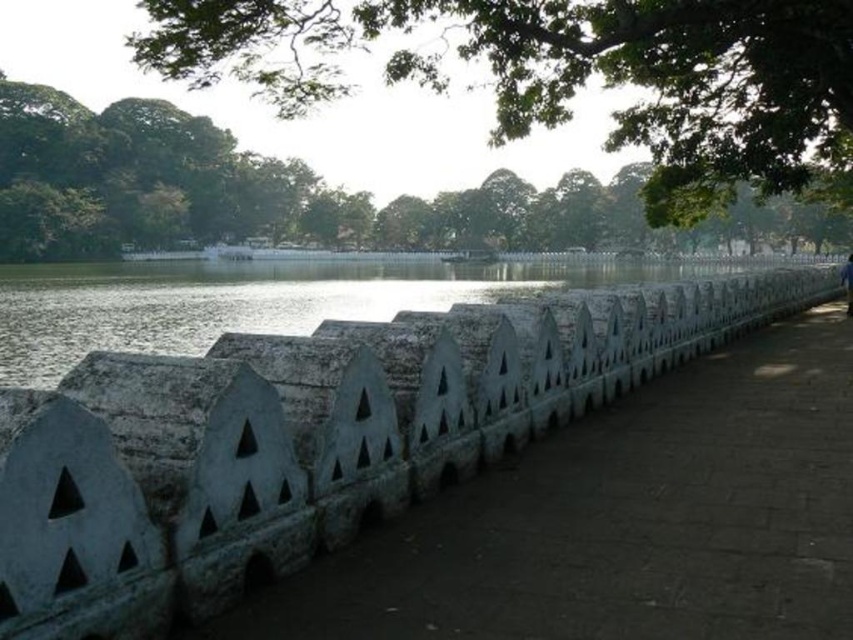
Is white stone fence at center closer to camera compared to green leafy tree at upper center?

Yes, white stone fence at center is in front of green leafy tree at upper center.

Can you confirm if white stone fence at center is positioned to the right of green leafy tree at upper center?

Yes, white stone fence at center is to the right of green leafy tree at upper center.

At what (x,y) coordinates should I click in order to perform the action: click on white stone fence at center. Please return your answer as a coordinate pair (x, y). Looking at the image, I should click on (310, 438).

Does green leafy tree at upper center have a lesser width compared to blue fabric person at center?

Incorrect, green leafy tree at upper center's width is not less than blue fabric person at center's.

How much distance is there between green leafy tree at upper center and blue fabric person at center?

The distance of green leafy tree at upper center from blue fabric person at center is 144.09 feet.

Does point (606, 4) come behind point (846, 273)?

No, it is not.

Locate an element on the screen. green leafy tree at upper center is located at coordinates (576, 76).

Is the position of white stone fence at center more distant than that of blue fabric person at center?

No, white stone fence at center is closer to the viewer.

Which is in front, point (96, 444) or point (851, 269)?

Point (96, 444) is more forward.

Where is `white stone fence at center`? The width and height of the screenshot is (853, 640). white stone fence at center is located at coordinates (310, 438).